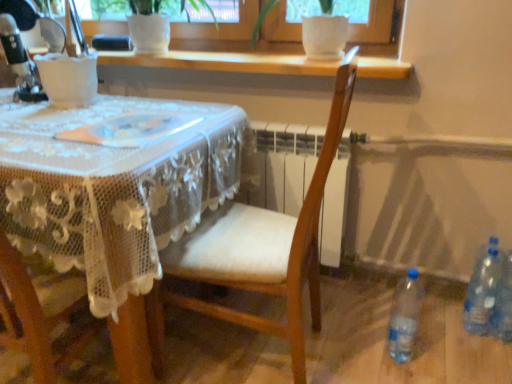
What do you see at coordinates (207, 40) in the screenshot?
I see `white plastic window frame at upper center` at bounding box center [207, 40].

What is the approximate height of clear plastic bottle at lower right, placed as the 1th bottle when sorted from right to left?

It is 34.69 centimeters.

At what (x,y) coordinates should I click in order to perform the action: click on white ceramic pot at upper center. Please return your answer as a coordinate pair (x, y). Looking at the image, I should click on (151, 8).

This screenshot has height=384, width=512. What do you see at coordinates (485, 295) in the screenshot?
I see `clear plastic bottle at lower right, which ranks as the second bottle in right-to-left order` at bounding box center [485, 295].

The image size is (512, 384). I want to click on metallic silver sewing machine at upper left, so click(20, 48).

You are a GUI agent. You are given a task and a screenshot of the screen. Output one action in this format:
    pyautogui.click(x=<x>, y=<y>)
    Task: Click on the wooden at upper center
    This screenshot has height=384, width=512.
    Given the screenshot: What is the action you would take?
    click(224, 62)

Does transparent plastic bottle at lower right, the 3th bottle when ordered from right to left, have a lesser height compared to metallic silver sewing machine at upper left?

Yes, transparent plastic bottle at lower right, the 3th bottle when ordered from right to left, is shorter than metallic silver sewing machine at upper left.

From a real-world perspective, is transparent plastic bottle at lower right, the 3th bottle when ordered from right to left, physically located above or below metallic silver sewing machine at upper left?

Clearly, from a real-world perspective, transparent plastic bottle at lower right, the 3th bottle when ordered from right to left, is below metallic silver sewing machine at upper left.

Is point (392, 341) closer or farther from the camera than point (14, 31)?

Clearly, point (392, 341) is closer to the camera than point (14, 31).

The height and width of the screenshot is (384, 512). I want to click on window sill above the transparent plastic bottle at lower right, the 3th bottle when ordered from right to left (from a real-world perspective), so click(224, 62).

Considering the positions of objects transparent plastic bottle at lower right, the 1th bottle in the left-to-right sequence, and wooden at upper center in the image provided, who is more to the right, transparent plastic bottle at lower right, the 1th bottle in the left-to-right sequence, or wooden at upper center?

Positioned to the right is transparent plastic bottle at lower right, the 1th bottle in the left-to-right sequence.

Can you tell me how much transparent plastic bottle at lower right, the 1th bottle in the left-to-right sequence, and wooden at upper center differ in facing direction?

They differ by 2.22 degrees in their facing directions.

Considering the sizes of objects transparent plastic bottle at lower right, the 3th bottle when ordered from right to left, and wooden at upper center in the image provided, who is shorter, transparent plastic bottle at lower right, the 3th bottle when ordered from right to left, or wooden at upper center?

Standing shorter between the two is wooden at upper center.

From a real-world perspective, is wooden chair at center located higher than clear plastic bottle at lower right, the third bottle when ordered from left to right?

Yes.

In the scene shown: Between wooden chair at center and clear plastic bottle at lower right, placed as the 1th bottle when sorted from right to left, which one has larger width?

With larger width is wooden chair at center.

Does wooden chair at center have a larger size compared to clear plastic bottle at lower right, the third bottle when ordered from left to right?

Yes.

From the image's perspective, which object appears higher, wooden chair at center or clear plastic bottle at lower right, placed as the 1th bottle when sorted from right to left?

wooden chair at center, from the image's perspective.

Between wooden at upper center and metallic silver sewing machine at upper left, which one has more height?

metallic silver sewing machine at upper left is taller.

Could you tell me if wooden at upper center is facing metallic silver sewing machine at upper left?

No, wooden at upper center is not turned towards metallic silver sewing machine at upper left.

Is wooden at upper center inside or outside of metallic silver sewing machine at upper left?

wooden at upper center is not enclosed by metallic silver sewing machine at upper left.

Considering the points (265, 71) and (7, 12), which point is behind, point (265, 71) or point (7, 12)?

The point (7, 12) is more distant.

Is white plastic window frame at upper center in contact with metallic silver sewing machine at upper left?

No.

Locate an element on the screen. The image size is (512, 384). sewing machine lying below the white plastic window frame at upper center (from the image's perspective) is located at coordinates (20, 48).

Is white plastic window frame at upper center smaller than metallic silver sewing machine at upper left?

No, white plastic window frame at upper center is not smaller than metallic silver sewing machine at upper left.

Consider the image. Is white plastic window frame at upper center surrounding metallic silver sewing machine at upper left?

No, metallic silver sewing machine at upper left is not inside white plastic window frame at upper center.

From the image's perspective, is clear plastic bottle at lower right, the third bottle when ordered from left to right, located above transparent plastic bottle at lower right, the 3th bottle when ordered from right to left?

Yes, from the image's perspective, clear plastic bottle at lower right, the third bottle when ordered from left to right, is over transparent plastic bottle at lower right, the 3th bottle when ordered from right to left.

Would you say transparent plastic bottle at lower right, the 1th bottle in the left-to-right sequence, is part of clear plastic bottle at lower right, placed as the 1th bottle when sorted from right to left,'s contents?

No, transparent plastic bottle at lower right, the 1th bottle in the left-to-right sequence, is located outside of clear plastic bottle at lower right, placed as the 1th bottle when sorted from right to left.

Does clear plastic bottle at lower right, placed as the 1th bottle when sorted from right to left, have a lesser height compared to transparent plastic bottle at lower right, the 3th bottle when ordered from right to left?

No.

Could you measure the distance between clear plastic bottle at lower right, the third bottle when ordered from left to right, and transparent plastic bottle at lower right, the 1th bottle in the left-to-right sequence?

clear plastic bottle at lower right, the third bottle when ordered from left to right, is 13.00 inches from transparent plastic bottle at lower right, the 1th bottle in the left-to-right sequence.

In the scene shown: Can you tell me how much clear plastic bottle at lower right, the second bottle viewed from the left, and white lace tablecloth at center differ in facing direction?

→ The angle between the facing direction of clear plastic bottle at lower right, the second bottle viewed from the left, and the facing direction of white lace tablecloth at center is 2.52 degrees.

Looking at this image, is clear plastic bottle at lower right, which ranks as the second bottle in right-to-left order, in front of or behind white lace tablecloth at center in the image?

Clearly, clear plastic bottle at lower right, which ranks as the second bottle in right-to-left order, is behind white lace tablecloth at center.

Is clear plastic bottle at lower right, which ranks as the second bottle in right-to-left order, directly adjacent to white lace tablecloth at center?

No, clear plastic bottle at lower right, which ranks as the second bottle in right-to-left order, is not beside white lace tablecloth at center.

Considering the points (482, 253) and (159, 245), which point is in front, point (482, 253) or point (159, 245)?

Positioned in front is point (159, 245).

Identify the location of sewing machine that is above the transparent plastic bottle at lower right, the 3th bottle when ordered from right to left (from the image's perspective). The height and width of the screenshot is (384, 512). (20, 48).

What are the coordinates of `window sill that is above the transparent plastic bottle at lower right, the 1th bottle in the left-to-right sequence (from a real-world perspective)` in the screenshot? It's located at (224, 62).

Looking at the image, which one is located closer to white lace tablecloth at center, transparent plastic bottle at lower right, the 3th bottle when ordered from right to left, or wooden chair at center?

Based on the image, wooden chair at center appears to be nearer to white lace tablecloth at center.

From the image, which object appears to be nearer to wooden at upper center, clear plastic bottle at lower right, the third bottle when ordered from left to right, or transparent plastic bottle at lower right, the 1th bottle in the left-to-right sequence?

transparent plastic bottle at lower right, the 1th bottle in the left-to-right sequence, lies closer to wooden at upper center than the other object.

Considering their positions, is transparent plastic bottle at lower right, the 1th bottle in the left-to-right sequence, positioned closer to white plastic window frame at upper center than clear plastic bottle at lower right, the second bottle viewed from the left?

Among the two, transparent plastic bottle at lower right, the 1th bottle in the left-to-right sequence, is located nearer to white plastic window frame at upper center.

Looking at the image, which one is located further to wooden chair at center, clear plastic bottle at lower right, which ranks as the second bottle in right-to-left order, or transparent plastic bottle at lower right, the 1th bottle in the left-to-right sequence?

clear plastic bottle at lower right, which ranks as the second bottle in right-to-left order.

In the scene shown: Which object lies nearer to the anchor point clear plastic bottle at lower right, placed as the 1th bottle when sorted from right to left, white lace tablecloth at center or metallic silver sewing machine at upper left?

white lace tablecloth at center is closer to clear plastic bottle at lower right, placed as the 1th bottle when sorted from right to left.

When comparing their distances from wooden at upper center, does white plastic window frame at upper center or clear plastic bottle at lower right, which ranks as the second bottle in right-to-left order, seem closer?

The object closer to wooden at upper center is white plastic window frame at upper center.

Based on their spatial positions, is transparent plastic bottle at lower right, the 1th bottle in the left-to-right sequence, or white ceramic pot at upper center further from white plastic window frame at upper center?

Among the two, transparent plastic bottle at lower right, the 1th bottle in the left-to-right sequence, is located further to white plastic window frame at upper center.

Which object lies further to the anchor point white ceramic pot at upper center, white plastic window frame at upper center or white lace tablecloth at center?

Based on the image, white lace tablecloth at center appears to be further to white ceramic pot at upper center.

Locate an element on the screen. The width and height of the screenshot is (512, 384). sewing machine between white plastic window frame at upper center and white lace tablecloth at center in the vertical direction is located at coordinates (20, 48).

Image resolution: width=512 pixels, height=384 pixels. I want to click on window frame situated between metallic silver sewing machine at upper left and clear plastic bottle at lower right, the third bottle when ordered from left to right, from left to right, so click(x=207, y=40).

Where is `window frame situated between white lace tablecloth at center and clear plastic bottle at lower right, the second bottle viewed from the left, from left to right`? This screenshot has width=512, height=384. window frame situated between white lace tablecloth at center and clear plastic bottle at lower right, the second bottle viewed from the left, from left to right is located at coordinates (207, 40).

At what (x,y) coordinates should I click in order to perform the action: click on chair between metallic silver sewing machine at upper left and clear plastic bottle at lower right, placed as the 1th bottle when sorted from right to left, from left to right. Please return your answer as a coordinate pair (x, y). Image resolution: width=512 pixels, height=384 pixels. Looking at the image, I should click on (258, 251).